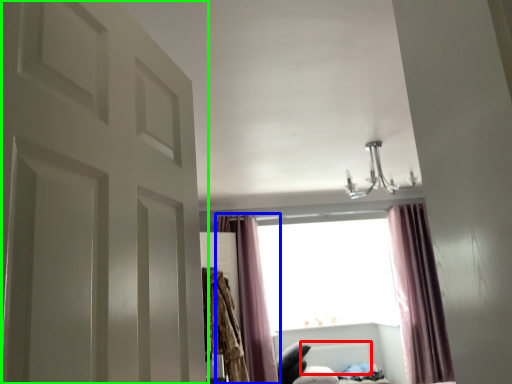
Question: Which object is positioned closest to radiator (highlighted by a red box)? Select from curtain (highlighted by a blue box) and door (highlighted by a green box).

Choices:
 (A) curtain
 (B) door

Answer: (A)